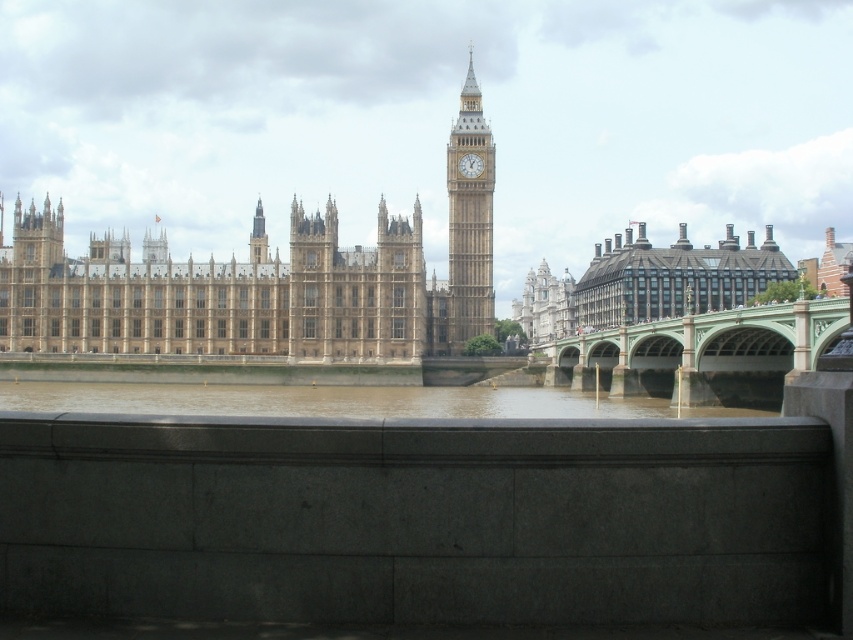
Question: Is the position of beige stone building at center more distant than that of gold textured clock at upper center?

Choices:
 (A) no
 (B) yes

Answer: (A)

Question: Which object is positioned farthest from the gold textured clock at upper center?

Choices:
 (A) golden stone clock tower at center
 (B) green stone bridge at center
 (C) brown muddy water at center

Answer: (C)

Question: Does beige stone building at center appear under gold textured clock at upper center?

Choices:
 (A) no
 (B) yes

Answer: (B)

Question: Which object is the closest to the gold textured clock at upper center?

Choices:
 (A) brown muddy water at center
 (B) green stone bridge at center

Answer: (B)

Question: Based on their relative distances, which object is farther from the brown muddy water at center?

Choices:
 (A) green stone bridge at center
 (B) golden stone clock tower at center
 (C) gold textured clock at upper center
 (D) beige stone building at center

Answer: (C)

Question: Is brown muddy water at center further to camera compared to gold textured clock at upper center?

Choices:
 (A) no
 (B) yes

Answer: (A)